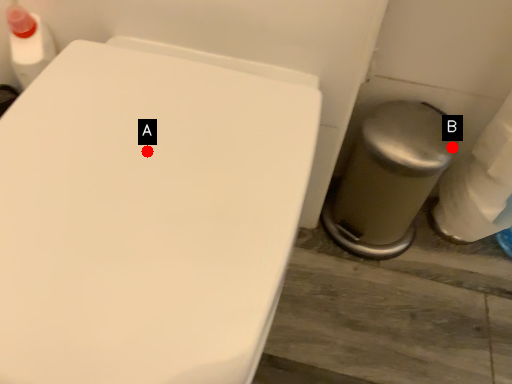
Question: Two points are circled on the image, labeled by A and B beside each circle. Which of the following is the farthest from the observer?

Choices:
 (A) A is further
 (B) B is further

Answer: (B)